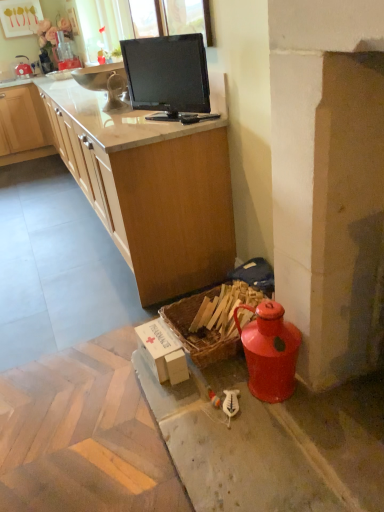
Find the location of a particular element. The width and height of the screenshot is (384, 512). vacant region in front of white cardboard box at lower center is located at coordinates (167, 395).